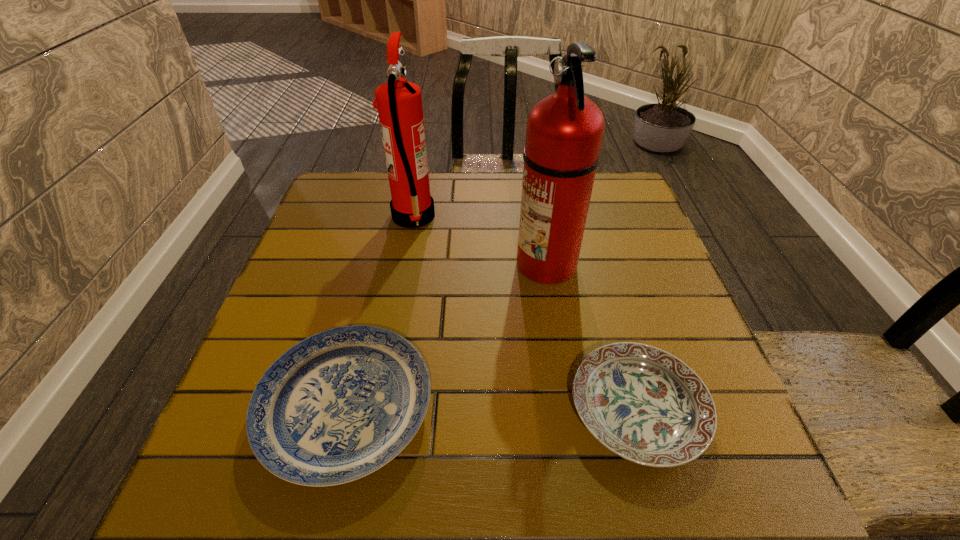
Identify the location of the right fire extinguisher. (564, 133).

The height and width of the screenshot is (540, 960). Find the location of `the left fire extinguisher`. the left fire extinguisher is located at coordinates (399, 103).

Image resolution: width=960 pixels, height=540 pixels. Find the location of `the shorter fire extinguisher`. the shorter fire extinguisher is located at coordinates (399, 103).

You are a GUI agent. You are given a task and a screenshot of the screen. Output one action in this format:
    pyautogui.click(x=<x>, y=<y>)
    Task: Click on the left plate
    
    Given the screenshot: What is the action you would take?
    pyautogui.click(x=337, y=406)

This screenshot has width=960, height=540. Find the location of `the right plate`. the right plate is located at coordinates (642, 403).

Identify the location of vacant area situated at the nozzle of the right fire extinguisher. This screenshot has height=540, width=960. (490, 263).

You are a GUI agent. You are given a task and a screenshot of the screen. Output one action in this format:
    pyautogui.click(x=<x>, y=<y>)
    Task: Click on the free space located 0.280m at the nozzle of the right fire extinguisher
    This screenshot has width=960, height=540.
    Given the screenshot: What is the action you would take?
    pyautogui.click(x=397, y=263)

Find the location of a particular element. The width and height of the screenshot is (960, 540). vacant area situated 0.390m at the nozzle of the right fire extinguisher is located at coordinates (350, 263).

Identify the location of blank area located with the nozzle aimed from the left fire extinguisher. [574, 217].

At what (x,y) coordinates should I click in order to perform the action: click on free space located 0.280m on the right of the left plate. Please return your answer as a coordinate pair (x, y). Looking at the image, I should click on (592, 408).